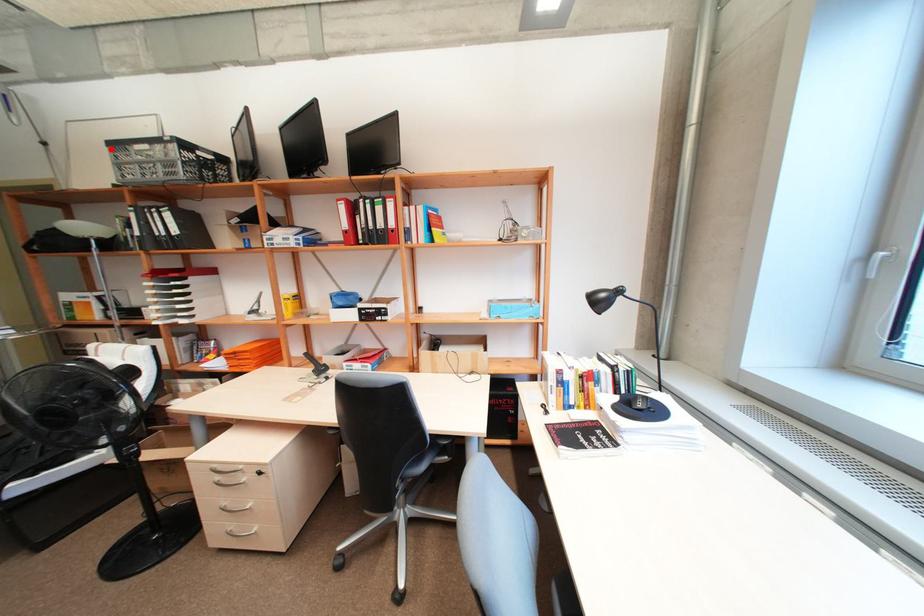
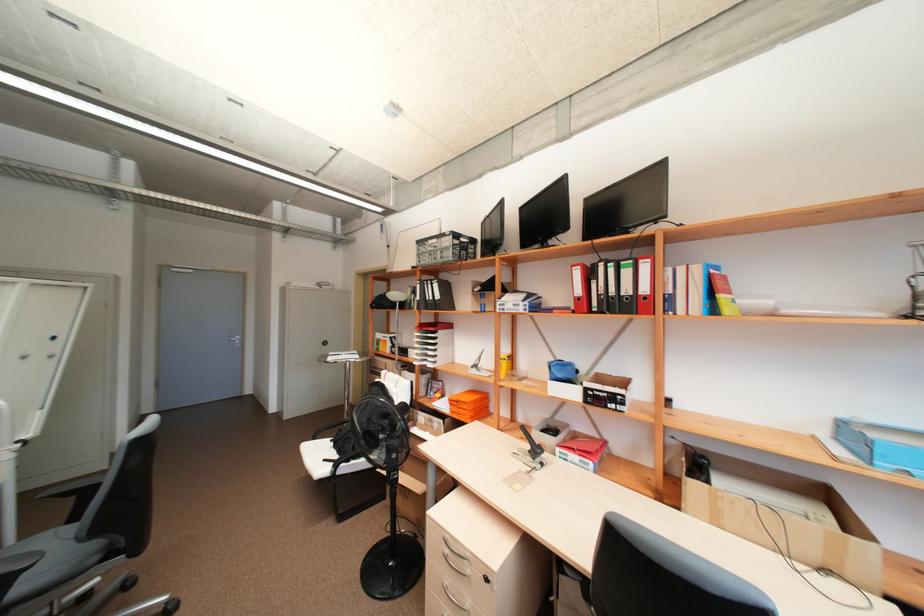
In the second image, find the point that corresponds to the highlighted location in the first image.

(420, 246)